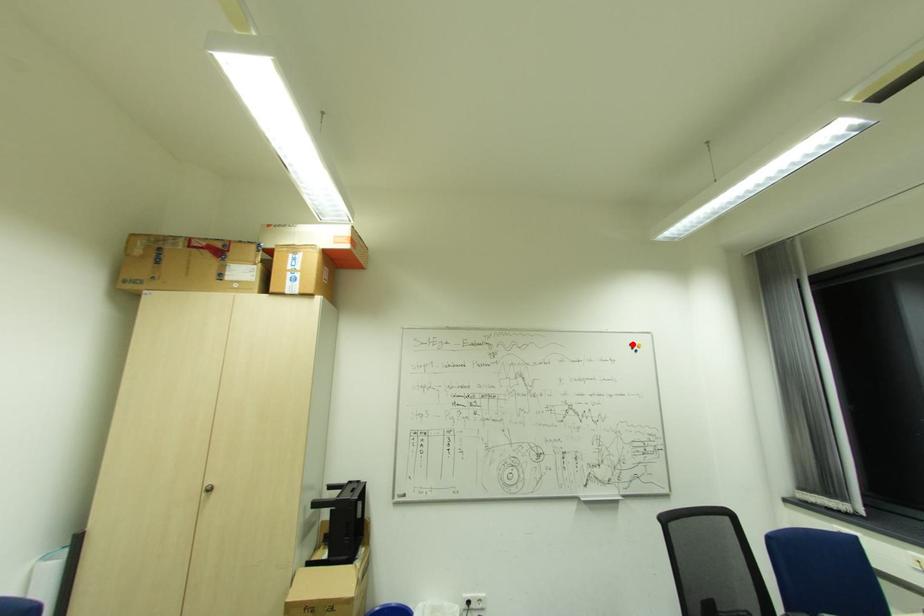
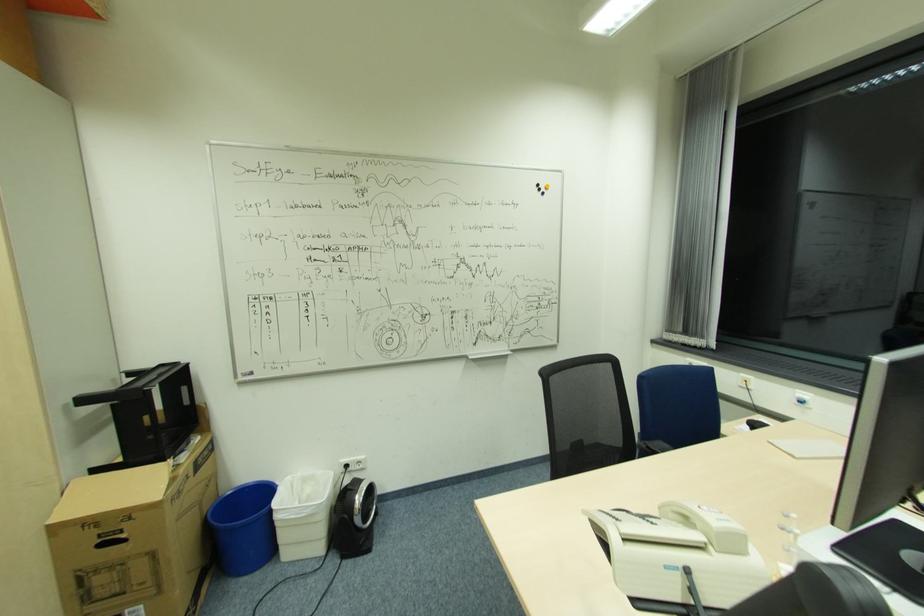
Question: I am providing you with two images of the same scene from different viewpoints. In image1, a red point is highlighted. Considering the same 3D point in image2, which of the following is correct?

Choices:
 (A) It is closer
 (B) It is farther

Answer: (A)